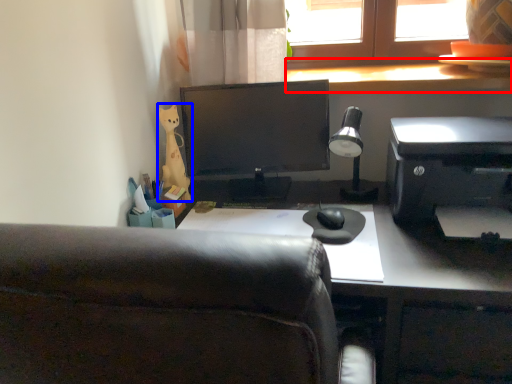
Question: Which of the following is the farthest to the observer, window sill (highlighted by a red box) or stationery (highlighted by a blue box)?

Choices:
 (A) window sill
 (B) stationery

Answer: (A)